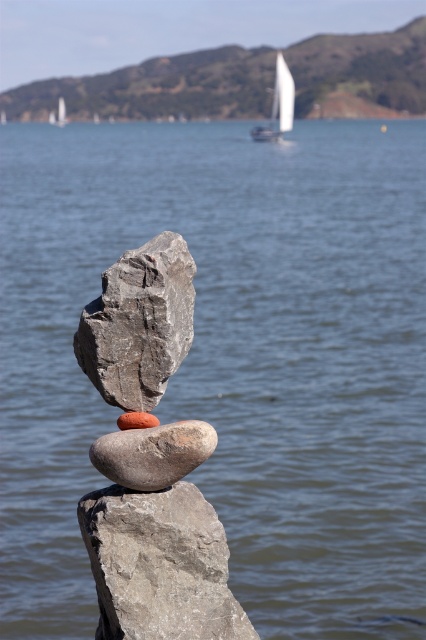
Question: Is smooth gray rock at upper center positioned before gray rough rock at center?

Choices:
 (A) yes
 (B) no

Answer: (B)

Question: Is smooth gray rock at upper center positioned before white sailboat at upper center?

Choices:
 (A) no
 (B) yes

Answer: (A)

Question: Is gray rock at center above smooth orange rock at center?

Choices:
 (A) yes
 (B) no

Answer: (A)

Question: Among these points, which one is farthest from the camera?

Choices:
 (A) (278, 115)
 (B) (400, 99)

Answer: (B)

Question: Which point is farther to the camera?

Choices:
 (A) gray rock at center
 (B) gray rough rock at center

Answer: (A)

Question: Based on their relative distances, which object is nearer to the white sailboat at upper center?

Choices:
 (A) smooth gray rock at upper center
 (B) smooth orange rock at center

Answer: (A)